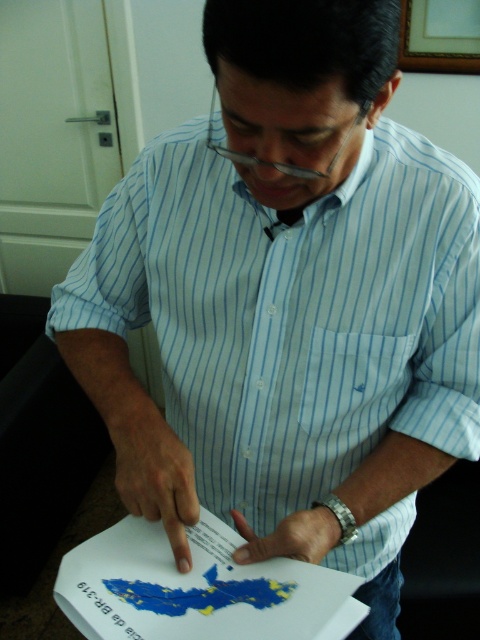
Question: Among these points, which one is nearest to the camera?

Choices:
 (A) (169, 596)
 (B) (313, 106)

Answer: (B)

Question: Does blue paper map at lower center have a larger size compared to clear plastic glasses at center?

Choices:
 (A) no
 (B) yes

Answer: (B)

Question: Which point is farther from the camera taking this photo?

Choices:
 (A) (311, 173)
 (B) (266, 579)

Answer: (B)

Question: Is blue paper map at lower center thinner than clear plastic glasses at center?

Choices:
 (A) yes
 (B) no

Answer: (B)

Question: From the image, what is the correct spatial relationship of blue paper map at lower center in relation to clear plastic glasses at center?

Choices:
 (A) left
 (B) right

Answer: (A)